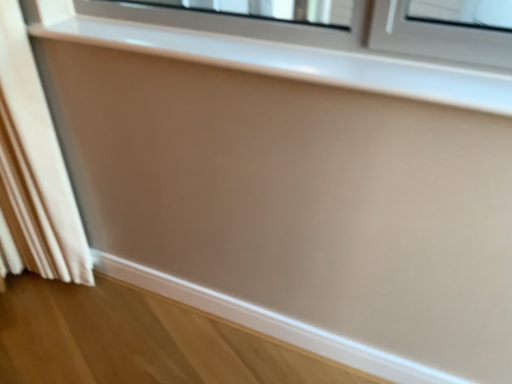
Describe the element at coordinates (38, 214) in the screenshot. Image resolution: width=512 pixels, height=384 pixels. I see `white fabric curtain at left` at that location.

The image size is (512, 384). Identify the location of white fabric curtain at left. coord(38,214).

Consider the image. Measure the distance between point [80,240] and camera.

A distance of 1.80 meters exists between point [80,240] and camera.

What do you see at coordinates (296, 62) in the screenshot? The image size is (512, 384). I see `matte white window sill at upper center` at bounding box center [296, 62].

In order to click on matte white window sill at upper center in this screenshot , I will do `click(296, 62)`.

This screenshot has width=512, height=384. I want to click on white fabric curtain at left, so click(x=38, y=214).

Which is more to the right, white fabric curtain at left or matte white window sill at upper center?

matte white window sill at upper center.

Between white fabric curtain at left and matte white window sill at upper center, which one is positioned behind?

white fabric curtain at left.

Which is in front, point (34, 252) or point (503, 99)?

The point (503, 99) is more forward.

From the image's perspective, which one is positioned lower, white fabric curtain at left or matte white window sill at upper center?

white fabric curtain at left.

From a real-world perspective, is white fabric curtain at left positioned above or below matte white window sill at upper center?

In terms of real-world spatial position, white fabric curtain at left is below matte white window sill at upper center.

Considering the relative sizes of white fabric curtain at left and matte white window sill at upper center in the image provided, is white fabric curtain at left wider than matte white window sill at upper center?

Indeed, white fabric curtain at left has a greater width compared to matte white window sill at upper center.

Does white fabric curtain at left have a lesser height compared to matte white window sill at upper center?

Incorrect, the height of white fabric curtain at left does not fall short of that of matte white window sill at upper center.

Considering the relative sizes of white fabric curtain at left and matte white window sill at upper center in the image provided, is white fabric curtain at left smaller than matte white window sill at upper center?

No.

Is white fabric curtain at left surrounding matte white window sill at upper center?

No.

Would you consider white fabric curtain at left to be distant from matte white window sill at upper center?

No, white fabric curtain at left is in close proximity to matte white window sill at upper center.

Is white fabric curtain at left oriented away from matte white window sill at upper center?

That's not correct — white fabric curtain at left is not looking away from matte white window sill at upper center.

What's the angular difference between white fabric curtain at left and matte white window sill at upper center's facing directions?

white fabric curtain at left and matte white window sill at upper center are facing 0.000424 degrees away from each other.

Find the location of a particular element. The width and height of the screenshot is (512, 384). window sill lying in front of the white fabric curtain at left is located at coordinates (296, 62).

Between matte white window sill at upper center and white fabric curtain at left, which one appears on the right side from the viewer's perspective?

matte white window sill at upper center.

Is matte white window sill at upper center behind white fabric curtain at left?

No, it is not.

Which is behind, point (204, 36) or point (69, 277)?

The point (69, 277) is more distant.

From the image's perspective, which object appears higher, matte white window sill at upper center or white fabric curtain at left?

matte white window sill at upper center, from the image's perspective.

From a real-world perspective, is matte white window sill at upper center above or below white fabric curtain at left?

From a real-world perspective, matte white window sill at upper center is physically above white fabric curtain at left.

Looking at this image, which object is wider, matte white window sill at upper center or white fabric curtain at left?

white fabric curtain at left is wider.

Who is taller, matte white window sill at upper center or white fabric curtain at left?

white fabric curtain at left is taller.

Is matte white window sill at upper center bigger or smaller than white fabric curtain at left?

matte white window sill at upper center is smaller than white fabric curtain at left.

Would you say matte white window sill at upper center contains white fabric curtain at left?

No.

Would you say matte white window sill at upper center is a long distance from white fabric curtain at left?

No, matte white window sill at upper center is not far away from white fabric curtain at left.

Does matte white window sill at upper center turn towards white fabric curtain at left?

No.

Based on the photo, how different are the orientations of matte white window sill at upper center and white fabric curtain at left in degrees?

The angular difference between matte white window sill at upper center and white fabric curtain at left is 0.000424 degrees.

Where is `window sill lying in front of the white fabric curtain at left`? window sill lying in front of the white fabric curtain at left is located at coordinates (296, 62).

The width and height of the screenshot is (512, 384). In order to click on curtain lying on the left of matte white window sill at upper center in this screenshot , I will do `click(38, 214)`.

This screenshot has width=512, height=384. What are the coordinates of `curtain that appears below the matte white window sill at upper center (from the image's perspective)` in the screenshot? It's located at (38, 214).